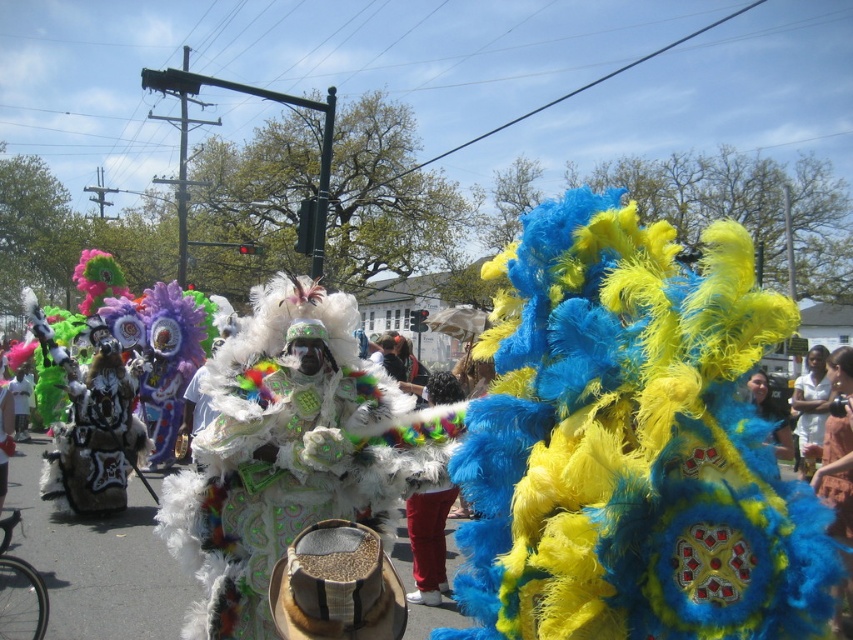
You are a photographer trying to capture both the white cotton shirt at right and the matte blue feathered headdress at center in a single frame. Which object should you focus on first to ensure both are in the shot?

The white cotton shirt at right is larger in size than the matte blue feathered headdress at center, so you should focus on the white cotton shirt at right first to ensure both are in the shot.

You are a photographer at the center of the scene. You want to take a photo of the red cotton pants at center and the matte blue feathered headdress at center. Which object should you focus on first if you want to capture both in the same frame without moving the camera?

You should focus on the red cotton pants at center first because it is positioned under the matte blue feathered headdress at center, so adjusting focus to the lower part will ensure both are in the frame.